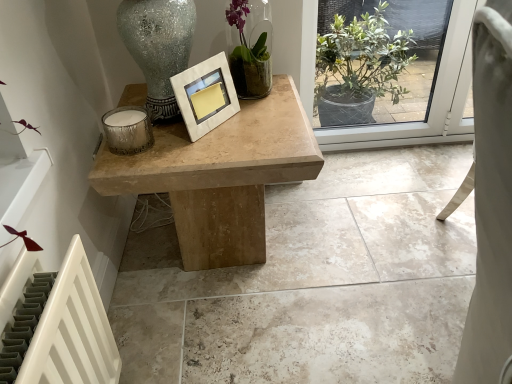
Locate an element on the screen. vacant space in front of white marble picture frame at center is located at coordinates (206, 153).